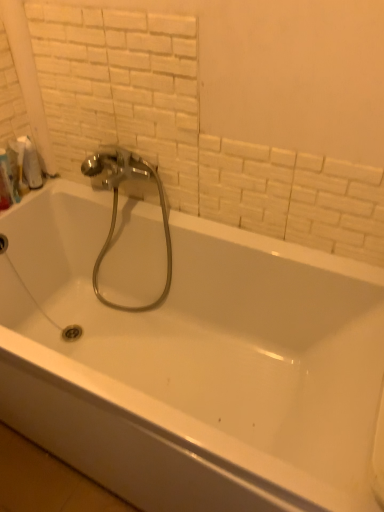
Question: Is white glossy bathtub at center further to camera compared to white matte toilet paper at upper left?

Choices:
 (A) no
 (B) yes

Answer: (A)

Question: Considering the relative sizes of white glossy bathtub at center and white matte toilet paper at upper left in the image provided, is white glossy bathtub at center smaller than white matte toilet paper at upper left?

Choices:
 (A) yes
 (B) no

Answer: (B)

Question: From the image's perspective, would you say white glossy bathtub at center is positioned over white matte toilet paper at upper left?

Choices:
 (A) yes
 (B) no

Answer: (B)

Question: Could you tell me if white glossy bathtub at center is turned towards white matte toilet paper at upper left?

Choices:
 (A) no
 (B) yes

Answer: (A)

Question: Is white matte toilet paper at upper left completely or partially inside white glossy bathtub at center?

Choices:
 (A) no
 (B) yes

Answer: (A)

Question: Looking at their shapes, would you say white matte toilet paper at upper left is wider or thinner than white glossy bathtub at center?

Choices:
 (A) thin
 (B) wide

Answer: (A)

Question: From the image's perspective, is white matte toilet paper at upper left positioned above or below white glossy bathtub at center?

Choices:
 (A) below
 (B) above

Answer: (B)

Question: Choose the correct answer: Is white matte toilet paper at upper left inside white glossy bathtub at center or outside it?

Choices:
 (A) inside
 (B) outside

Answer: (B)

Question: Considering their positions, is white matte toilet paper at upper left located in front of or behind white glossy bathtub at center?

Choices:
 (A) front
 (B) behind

Answer: (B)

Question: Is polished chrome faucet at upper center taller or shorter than white plastic bottle at upper left?

Choices:
 (A) short
 (B) tall

Answer: (B)

Question: In the image, is polished chrome faucet at upper center on the left side or the right side of white plastic bottle at upper left?

Choices:
 (A) right
 (B) left

Answer: (A)

Question: Considering the positions of polished chrome faucet at upper center and white plastic bottle at upper left in the image, is polished chrome faucet at upper center bigger or smaller than white plastic bottle at upper left?

Choices:
 (A) big
 (B) small

Answer: (A)

Question: Relative to white plastic bottle at upper left, is polished chrome faucet at upper center in front or behind?

Choices:
 (A) behind
 (B) front

Answer: (B)

Question: In terms of height, does polished chrome faucet at upper center look taller or shorter compared to white matte toilet paper at upper left?

Choices:
 (A) short
 (B) tall

Answer: (B)

Question: From a real-world perspective, is polished chrome faucet at upper center positioned above or below white matte toilet paper at upper left?

Choices:
 (A) below
 (B) above

Answer: (A)